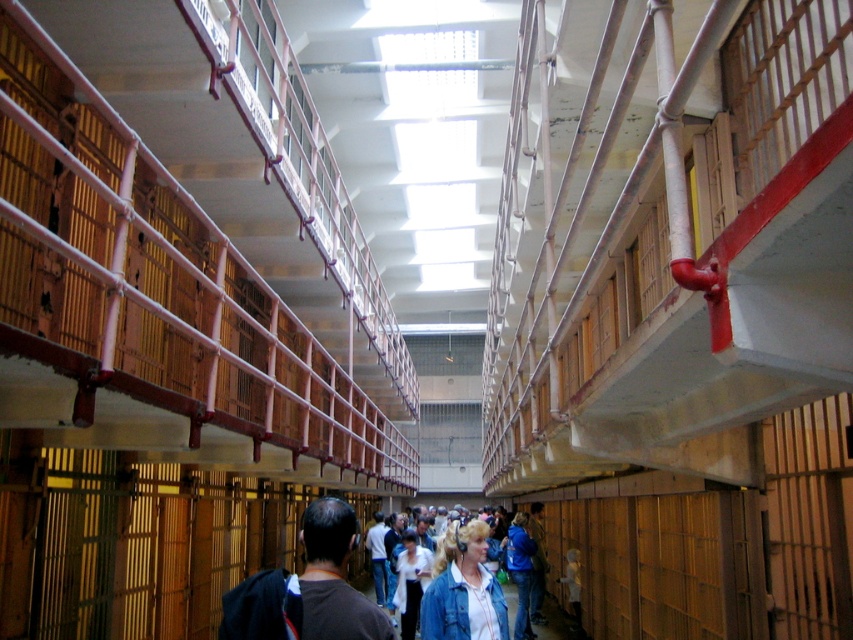
Who is shorter, dark brown hair at center or white shirt at center?

dark brown hair at center

Does dark brown hair at center have a larger size compared to white shirt at center?

Actually, dark brown hair at center might be smaller than white shirt at center.

Is point (346, 508) more distant than point (413, 637)?

No, it is not.

Locate an element on the screen. This screenshot has height=640, width=853. dark brown hair at center is located at coordinates (334, 577).

Can you confirm if denim jacket at lower center is positioned above blue denim jacket at center?

Yes, denim jacket at lower center is above blue denim jacket at center.

In the scene shown: Does denim jacket at lower center appear on the right side of blue denim jacket at center?

In fact, denim jacket at lower center is to the left of blue denim jacket at center.

Does point (476, 545) come farther from viewer compared to point (514, 531)?

No, it is in front of (514, 531).

Where is `denim jacket at lower center`? Image resolution: width=853 pixels, height=640 pixels. denim jacket at lower center is located at coordinates (463, 588).

Does rustic wood rail at center come behind dark brown hair at center?

Yes, rustic wood rail at center is behind dark brown hair at center.

Can you confirm if rustic wood rail at center is wider than dark brown hair at center?

Yes.

Between point (68, 268) and point (329, 566), which one is positioned in front?

Positioned in front is point (329, 566).

Where is `rustic wood rail at center`? This screenshot has width=853, height=640. rustic wood rail at center is located at coordinates (155, 280).